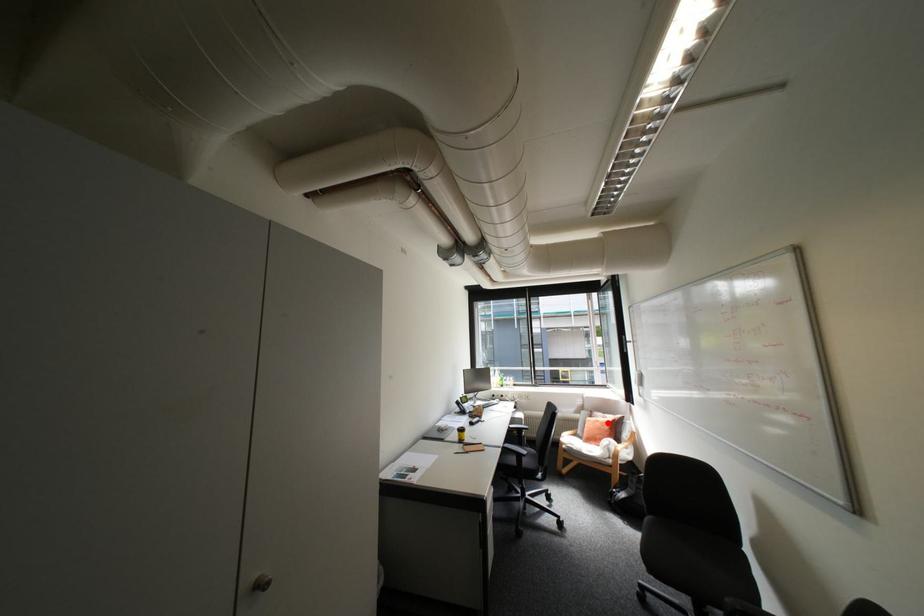
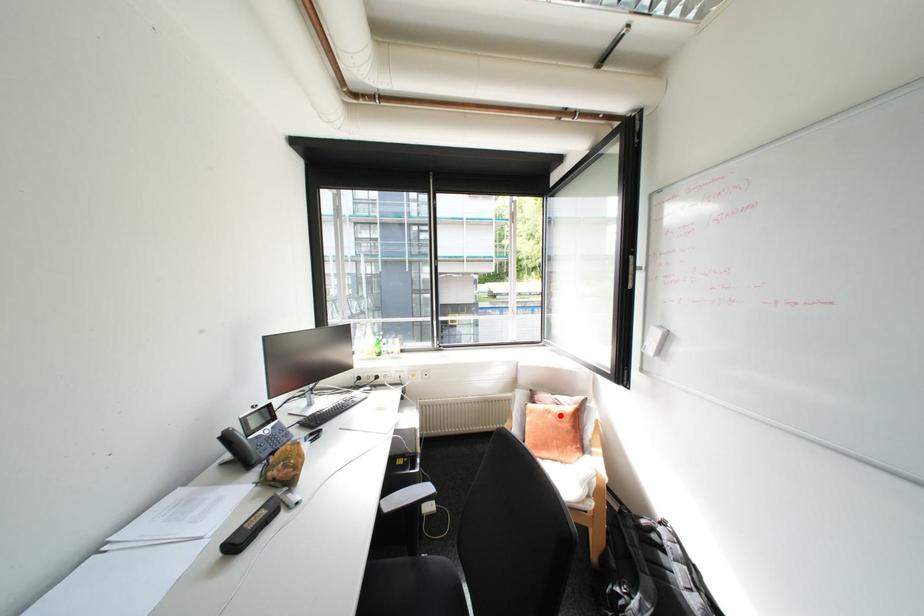
I am providing you with two images of the same scene from different viewpoints. A red point is marked on the first image and another point is marked on the second image. Are the points marked in image1 and image2 representing the same 3D position?

Yes